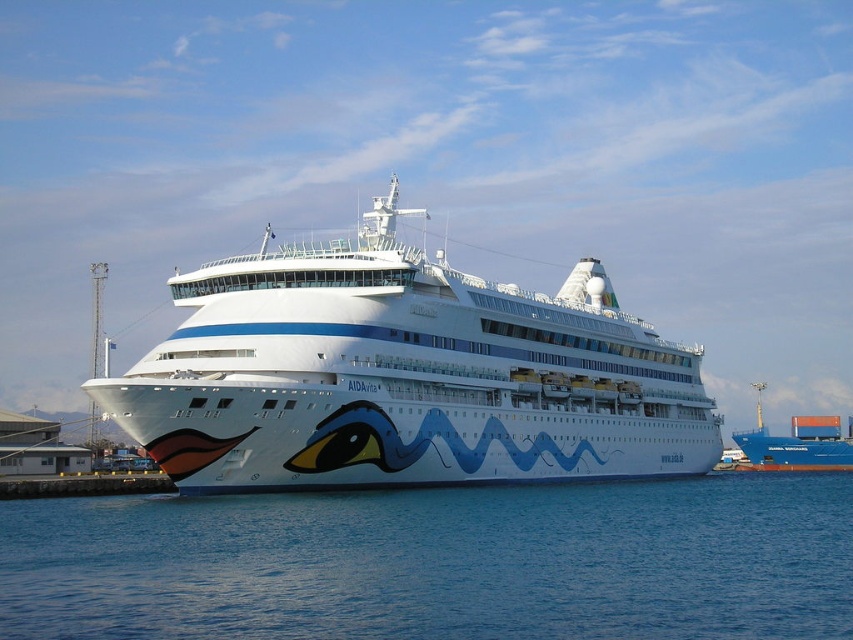
Who is higher up, white glossy cruise ship at center or blue matte cargo ship at center?

Positioned higher is white glossy cruise ship at center.

Who is positioned more to the right, white glossy cruise ship at center or blue matte cargo ship at center?

From the viewer's perspective, blue matte cargo ship at center appears more on the right side.

Where is `white glossy cruise ship at center`? This screenshot has width=853, height=640. white glossy cruise ship at center is located at coordinates (405, 376).

Is point (624, 573) closer to viewer compared to point (792, 416)?

Yes, point (624, 573) is in front of point (792, 416).

Does blue liquid water at lower center have a larger size compared to blue matte cargo ship at center?

Answer: Incorrect, blue liquid water at lower center is not larger than blue matte cargo ship at center.

Who is more distant from viewer, (x=660, y=560) or (x=843, y=456)?

Positioned behind is point (x=843, y=456).

This screenshot has width=853, height=640. I want to click on blue liquid water at lower center, so click(439, 563).

Which is above, blue liquid water at lower center or white glossy cruise ship at center?

Positioned higher is white glossy cruise ship at center.

Does blue liquid water at lower center have a lesser height compared to white glossy cruise ship at center?

Correct, blue liquid water at lower center is not as tall as white glossy cruise ship at center.

Where is `blue liquid water at lower center`? blue liquid water at lower center is located at coordinates (439, 563).